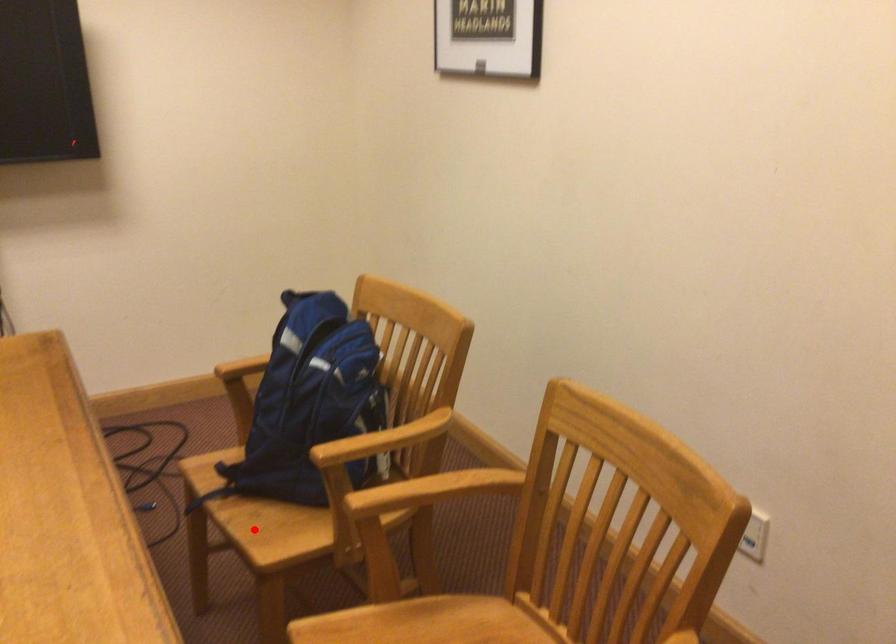
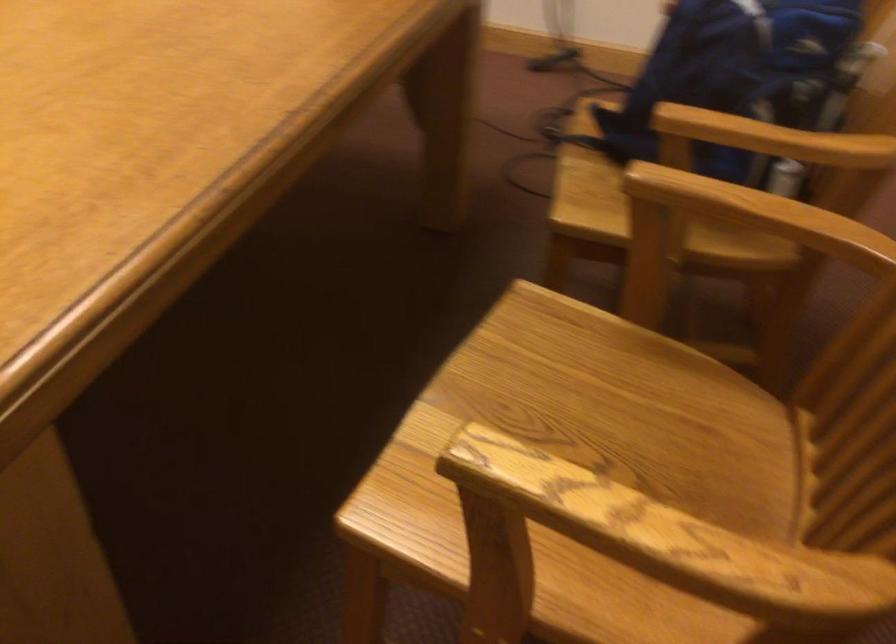
Locate, in the second image, the point that corresponds to the highlighted location in the first image.

(584, 187)